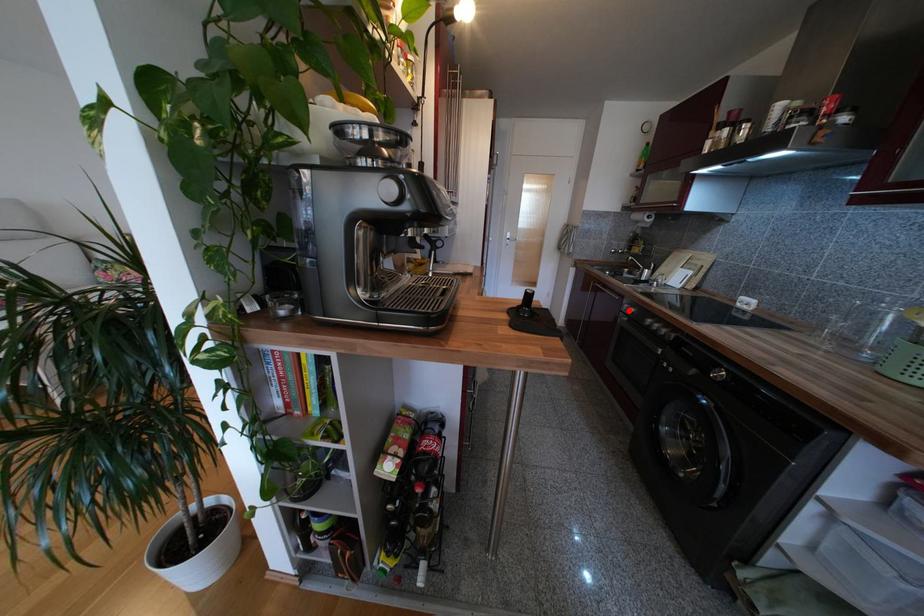
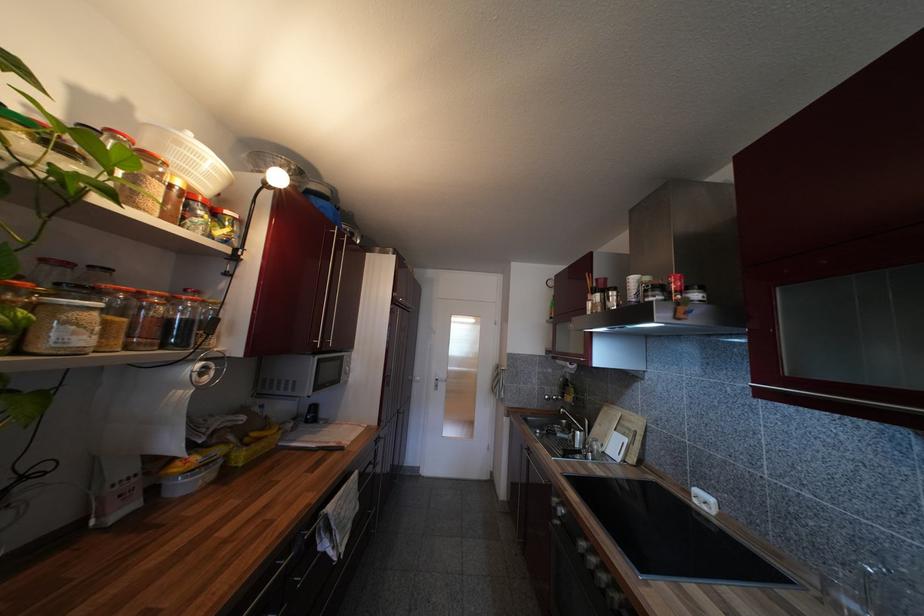
Question: A red point is marked in image1. In image2, is the corresponding 3D point closer to the camera or farther? Reply with the corresponding letter.

Choices:
 (A) The corresponding 3D point is closer.
 (B) The corresponding 3D point is farther.

Answer: (B)